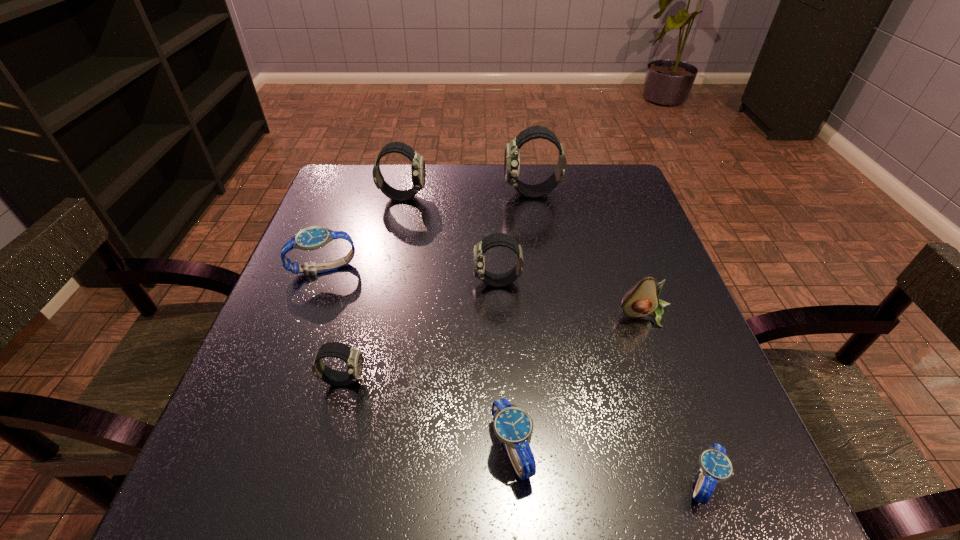
Identify the location of vacant space that is in between the second nearest dark watch and the shortest watch. pyautogui.click(x=600, y=382).

In order to click on free space between the second shortest watch and the biggest blue watch in this screenshot , I will do `click(418, 359)`.

I want to click on unoccupied area between the smallest blue watch and the third farthest dark watch, so click(600, 382).

Find the location of a particular element. blank region between the smallest blue watch and the biggest dark watch is located at coordinates (617, 338).

Where is `vacant space that is in between the avocado and the fifth shortest watch`? vacant space that is in between the avocado and the fifth shortest watch is located at coordinates (571, 299).

Where is `vacant area that lies between the second biggest dark watch and the second shortest object`? This screenshot has width=960, height=540. vacant area that lies between the second biggest dark watch and the second shortest object is located at coordinates (457, 323).

Choose which object is the fifth nearest neighbor to the seventh shortest object. Please provide its 2D coordinates. Your answer should be formatted as a tuple, i.e. [(x, y)], where the tuple contains the x and y coordinates of a point satisfying the conditions above.

[(641, 300)]

Point out which object is positioned as the sixth nearest to the shortest object. Please provide its 2D coordinates. Your answer should be formatted as a tuple, i.e. [(x, y)], where the tuple contains the x and y coordinates of a point satisfying the conditions above.

[(311, 238)]

You are a GUI agent. You are given a task and a screenshot of the screen. Output one action in this format:
    pyautogui.click(x=<x>, y=<y>)
    Task: Click on the closest watch to the second nearest dark watch
    
    Given the screenshot: What is the action you would take?
    pyautogui.click(x=512, y=151)

Point out which watch is positioned as the fourth nearest to the second smallest dark watch. Please provide its 2D coordinates. Your answer should be formatted as a tuple, i.e. [(x, y)], where the tuple contains the x and y coordinates of a point satisfying the conditions above.

[(513, 426)]